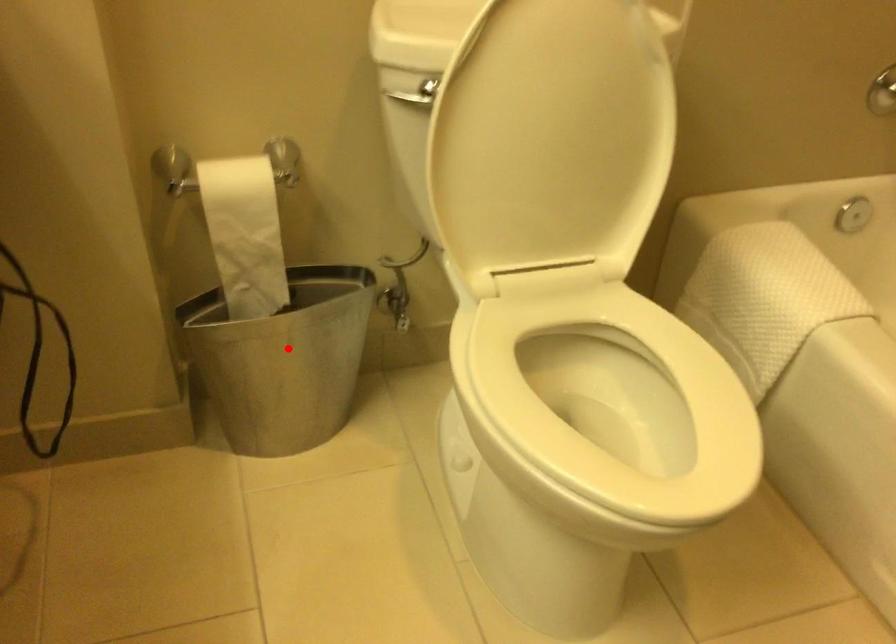
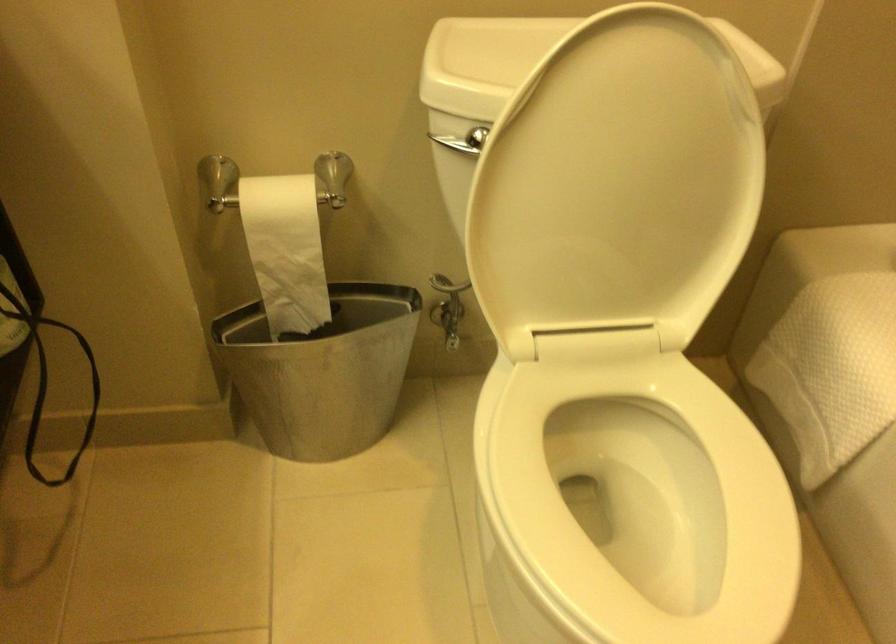
In the second image, find the point that corresponds to the highlighted location in the first image.

(323, 371)